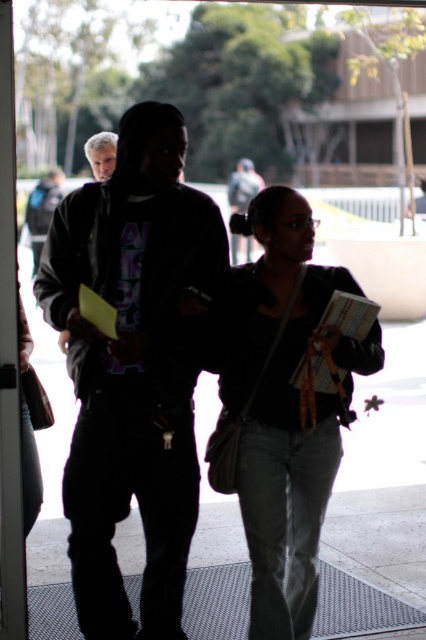
You are designing a mannequin stand for a clothing store and need to display both the dark matte jacket at center and the denim jeans at center. Based on their positions in the image, which item should be placed higher on the stand to match their real sizes?

The dark matte jacket at center has a greater height compared to denim jeans at center, so it should be placed higher on the mannequin stand to reflect their actual sizes.

You are standing at the entrance of the university building and see the point at coordinates (x=379, y=538). What object is located at that point?

The point at coordinates (x=379, y=538) corresponds to the gray rubber mat at lower center.

You are a delivery person carrying a large box that measures 1.2 meters in length. You need to walk through the entrance shown in the image. Considering the gray rubber mat at lower center and the matte black hoodie at center, which object would the box most likely hit first as you pass through the entrance?

The box would most likely hit the gray rubber mat at lower center first because it is larger in size compared to the matte black hoodie at center, making it more prominent in the path.